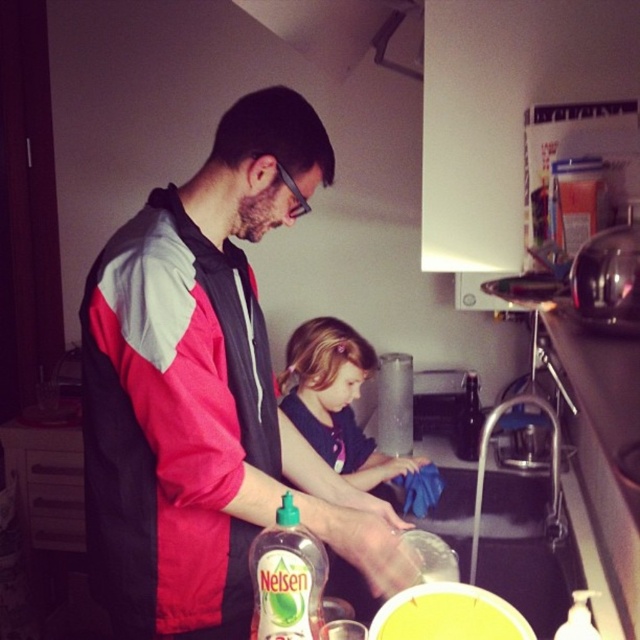
Question: From the image, what is the correct spatial relationship of matte red jacket at center in relation to brushed metal exhaust hood at upper center?

Choices:
 (A) above
 (B) below

Answer: (B)

Question: Is matte red jacket at center positioned before brushed metal exhaust hood at upper center?

Choices:
 (A) yes
 (B) no

Answer: (A)

Question: Is matte red jacket at center further to the viewer compared to brushed metal exhaust hood at upper center?

Choices:
 (A) yes
 (B) no

Answer: (B)